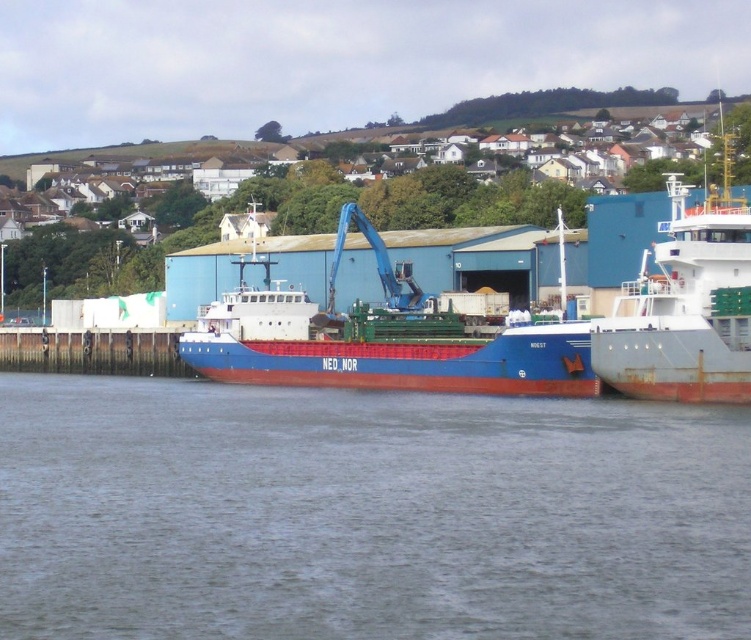
Question: Which point is farther from the camera taking this photo?

Choices:
 (A) (332, 316)
 (B) (175, 618)

Answer: (A)

Question: Observing the image, what is the correct spatial positioning of gray water at center in reference to blue matte cargo ship at center?

Choices:
 (A) left
 (B) right

Answer: (A)

Question: Which object is closer to the camera taking this photo?

Choices:
 (A) blue matte cargo ship at center
 (B) gray water at center

Answer: (B)

Question: Is gray water at center to the right of blue matte cargo ship at center from the viewer's perspective?

Choices:
 (A) no
 (B) yes

Answer: (A)

Question: Is gray water at center closer to camera compared to blue matte cargo ship at center?

Choices:
 (A) yes
 (B) no

Answer: (A)